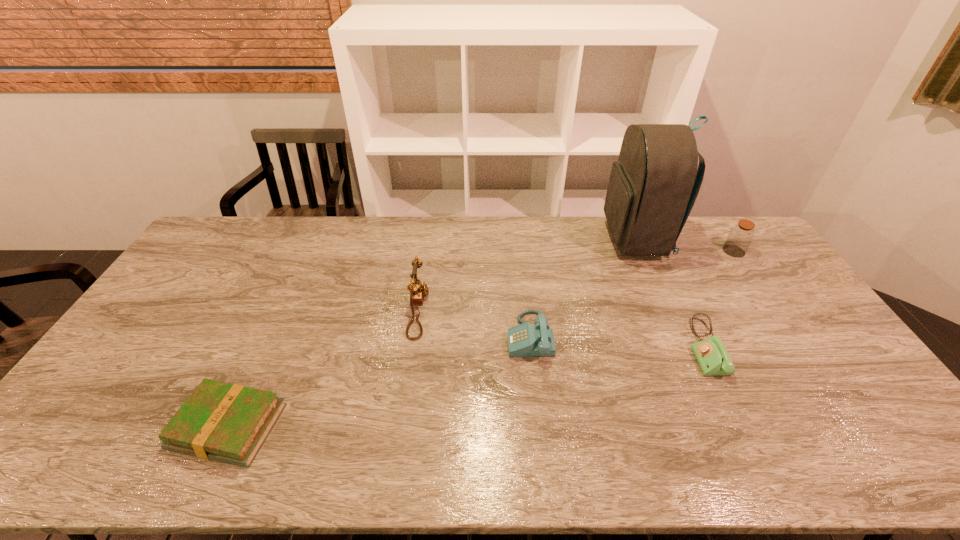
The image size is (960, 540). What are the coordinates of `vacant space located 0.090m on the front-facing side of the tallest object` in the screenshot? It's located at (580, 239).

I want to click on free space located 0.110m on the front-facing side of the tallest object, so click(575, 239).

Where is `free space located on the front-facing side of the tallest telephone`? free space located on the front-facing side of the tallest telephone is located at coordinates (517, 309).

Identify the location of vacant area situated on the left of the jar. (690, 251).

Locate an element on the screen. Image resolution: width=960 pixels, height=540 pixels. blank space located on the dial of the second tallest telephone is located at coordinates (397, 336).

The image size is (960, 540). Find the location of `free space located on the dial of the second tallest telephone`. free space located on the dial of the second tallest telephone is located at coordinates (374, 336).

Where is `free space located 0.360m on the dial of the second tallest telephone`? This screenshot has width=960, height=540. free space located 0.360m on the dial of the second tallest telephone is located at coordinates (384, 336).

Locate an element on the screen. Image resolution: width=960 pixels, height=540 pixels. free region located on the dial of the shortest telephone is located at coordinates (602, 347).

Where is `free space located on the dial of the shortest telephone`? The height and width of the screenshot is (540, 960). free space located on the dial of the shortest telephone is located at coordinates (627, 347).

Where is `free space located 0.360m on the dial of the shortest telephone`? The height and width of the screenshot is (540, 960). free space located 0.360m on the dial of the shortest telephone is located at coordinates (564, 347).